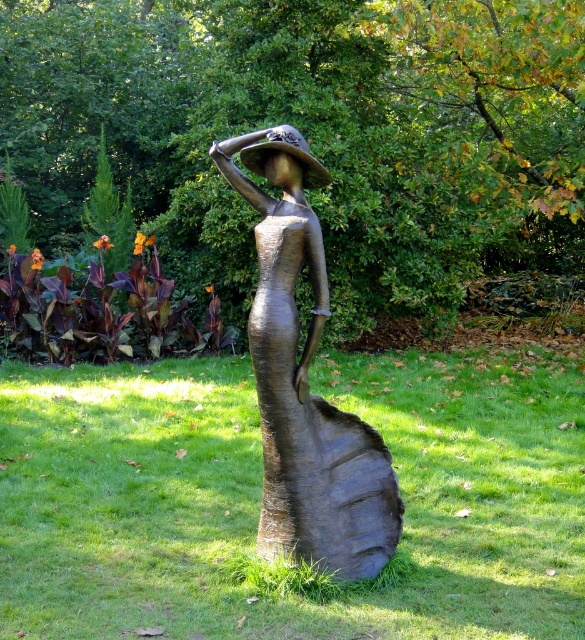
Which is in front, point (415, 380) or point (270, 250)?

Point (270, 250)

Is point (570, 604) more distant than point (366, 465)?

That is False.

Locate an element on the screen. green grass at center is located at coordinates (259, 497).